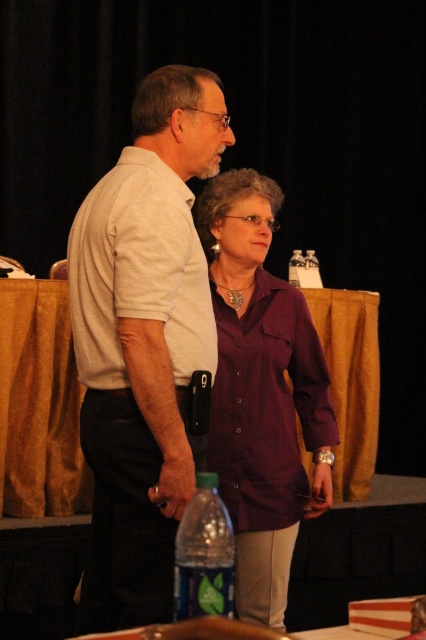
How far apart are purple cotton shirt at center and clear plastic bottle at center?

purple cotton shirt at center and clear plastic bottle at center are 1.16 meters apart from each other.

Who is taller, purple cotton shirt at center or clear plastic bottle at center?

Standing taller between the two is purple cotton shirt at center.

Between point (230, 192) and point (54, 387), which one is positioned behind?

Point (54, 387)

Where is `purple cotton shirt at center`? The width and height of the screenshot is (426, 640). purple cotton shirt at center is located at coordinates (261, 392).

Is white matte shirt at center positioned behind green plastic bottle at lower center?

Yes.

Is point (109, 592) in front of point (219, 499)?

No, it is behind (219, 499).

Who is more forward, (x=132, y=115) or (x=206, y=524)?

Positioned in front is point (x=206, y=524).

Image resolution: width=426 pixels, height=640 pixels. I want to click on white matte shirt at center, so click(143, 342).

Does white matte shirt at center have a greater width compared to white cotton shirt at center?

Yes.

Between white matte shirt at center and white cotton shirt at center, which one appears on the left side from the viewer's perspective?

Positioned to the left is white cotton shirt at center.

I want to click on white matte shirt at center, so click(x=143, y=342).

Image resolution: width=426 pixels, height=640 pixels. In order to click on white matte shirt at center in this screenshot , I will do `click(143, 342)`.